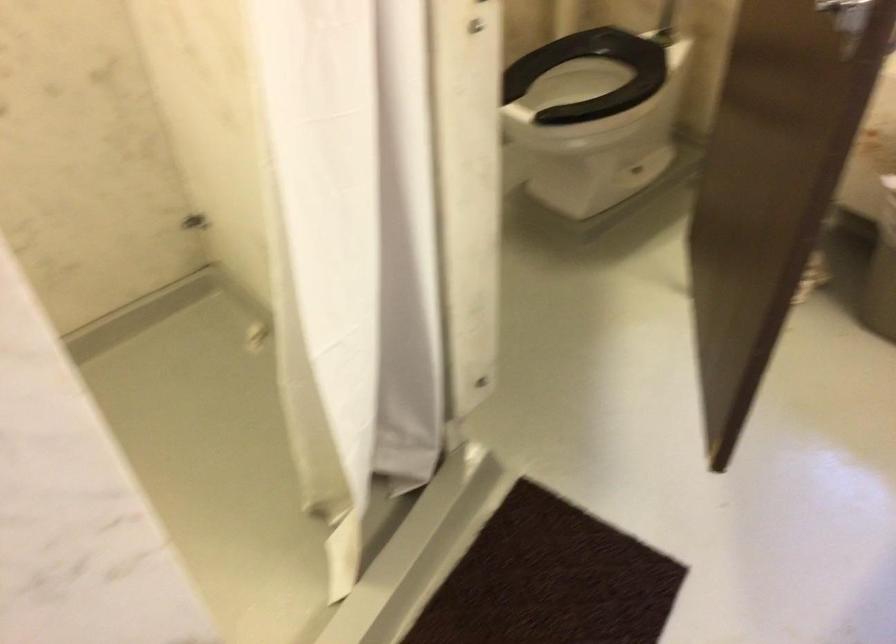
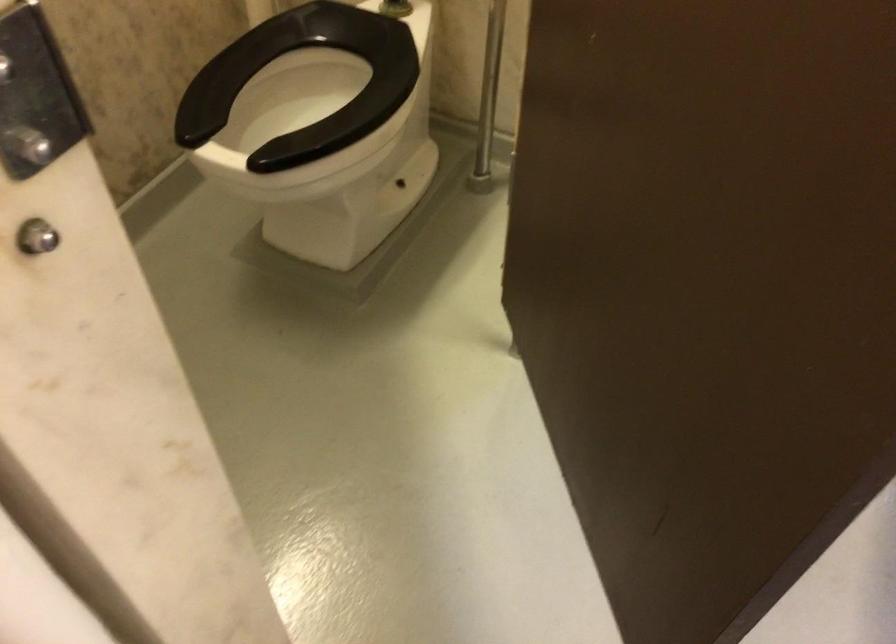
Question: The camera is either moving clockwise (left) or counter-clockwise (right) around the object. The first image is from the beginning of the video and the second image is from the end. Is the camera moving left or right when shooting the video?

Choices:
 (A) Left
 (B) Right

Answer: (A)